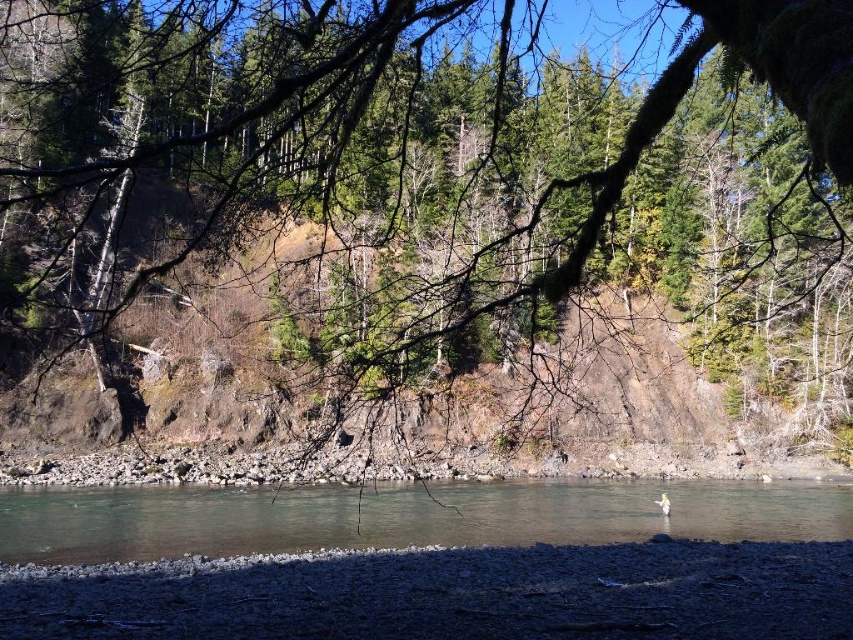
Question: Can you confirm if green matte tree at center is wider than clear water at center?

Choices:
 (A) no
 (B) yes

Answer: (B)

Question: Which point is closer to the camera taking this photo?

Choices:
 (A) (279, 76)
 (B) (799, 500)

Answer: (A)

Question: Is green matte tree at center thinner than clear water at center?

Choices:
 (A) yes
 (B) no

Answer: (B)

Question: Can you confirm if green matte tree at center is smaller than clear water at center?

Choices:
 (A) no
 (B) yes

Answer: (A)

Question: Which point is closer to the camera?

Choices:
 (A) green matte tree at center
 (B) clear water at center

Answer: (A)